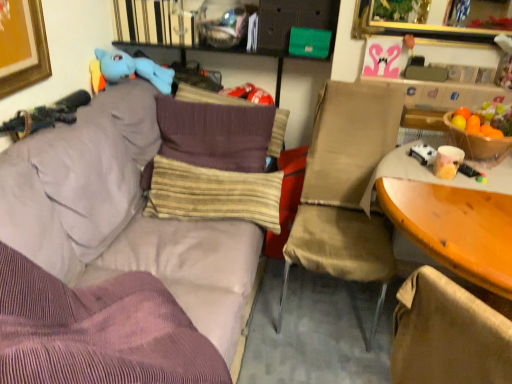
This screenshot has width=512, height=384. What do you see at coordinates (208, 97) in the screenshot? I see `purple corduroy pillow at center, marked as the 1th pillow in a top-to-bottom arrangement` at bounding box center [208, 97].

What do you see at coordinates (134, 69) in the screenshot? This screenshot has width=512, height=384. I see `blue plush toy at upper left` at bounding box center [134, 69].

This screenshot has height=384, width=512. Find the location of `wooden table at right`. wooden table at right is located at coordinates (449, 223).

At what (x,y) coordinates should I click in order to perform the action: click on purple corduroy couch at upper left. Please return your answer as a coordinate pair (x, y). Looking at the image, I should click on (119, 240).

The image size is (512, 384). Identify the location of purple corduroy pillow at center, marked as the 1th pillow in a top-to-bottom arrangement. (208, 97).

Is blue plush toy at upper left beside wooden table at right?

No.

From a real-world perspective, does blue plush toy at upper left stand above wooden table at right?

Yes, from a real-world perspective, blue plush toy at upper left is on top of wooden table at right.

Considering the sizes of objects blue plush toy at upper left and wooden table at right in the image provided, who is taller, blue plush toy at upper left or wooden table at right?

Standing taller between the two is wooden table at right.

Consider the image. In the image, is blue plush toy at upper left positioned in front of or behind wooden table at right?

blue plush toy at upper left is positioned farther from the viewer than wooden table at right.

From the picture: From a real-world perspective, is wooden table at right physically below purple corduroy couch at upper left?

Incorrect, from a real-world perspective, wooden table at right is higher than purple corduroy couch at upper left.

In the image, is wooden table at right on the left side or the right side of purple corduroy couch at upper left?

wooden table at right is positioned on purple corduroy couch at upper left's right side.

This screenshot has height=384, width=512. Find the location of `studio couch in front of the wooden table at right`. studio couch in front of the wooden table at right is located at coordinates (119, 240).

From the image's perspective, which is above, wooden table at right or purple corduroy couch at upper left?

From the image's view, purple corduroy couch at upper left is above.

How distant is beige fabric chair at center from purple corduroy pillow at center, positioned as the first pillow in back-to-front order?

beige fabric chair at center is 26.23 inches from purple corduroy pillow at center, positioned as the first pillow in back-to-front order.

Considering the relative sizes of beige fabric chair at center and purple corduroy pillow at center, which is the second pillow in front-to-back order, in the image provided, is beige fabric chair at center bigger than purple corduroy pillow at center, which is the second pillow in front-to-back order,?

Correct, beige fabric chair at center is larger in size than purple corduroy pillow at center, which is the second pillow in front-to-back order.

In order to click on chair below the purple corduroy pillow at center, which is counted as the 2th pillow, starting from the bottom (from the image's perspective) in this screenshot , I will do `click(345, 190)`.

Is blue plush toy at upper left in contact with beige fabric chair at center?

No, blue plush toy at upper left is not with beige fabric chair at center.

Which point is more forward, (129, 69) or (381, 290)?

The point (381, 290) is closer to the camera.

In the image, is blue plush toy at upper left on the left side or the right side of beige fabric chair at center?

Clearly, blue plush toy at upper left is on the left of beige fabric chair at center in the image.

Would you say beige fabric chair at center is part of blue plush toy at upper left's contents?

That's incorrect, beige fabric chair at center is not inside blue plush toy at upper left.

From the image's perspective, which one is positioned lower, striped fabric pillow at center, which is the 1th pillow in front-to-back order, or purple corduroy pillow at center, which is the second pillow in front-to-back order?

striped fabric pillow at center, which is the 1th pillow in front-to-back order, appears lower in the image.

From a real-world perspective, between striped fabric pillow at center, the first pillow from the bottom, and purple corduroy pillow at center, which is the second pillow in front-to-back order, who is vertically lower?

From a 3D spatial view, striped fabric pillow at center, the first pillow from the bottom, is below.

How different are the orientations of striped fabric pillow at center, acting as the 2th pillow starting from the back, and purple corduroy pillow at center, which is the second pillow in front-to-back order, in degrees?

striped fabric pillow at center, acting as the 2th pillow starting from the back, and purple corduroy pillow at center, which is the second pillow in front-to-back order, are facing 0.000933 degrees away from each other.

Considering their positions, is striped fabric pillow at center, acting as the 2th pillow starting from the back, located in front of or behind purple corduroy pillow at center, which is the second pillow in front-to-back order?

striped fabric pillow at center, acting as the 2th pillow starting from the back, is positioned closer to the viewer than purple corduroy pillow at center, which is the second pillow in front-to-back order.

Considering their positions, is purple corduroy pillow at center, positioned as the first pillow in back-to-front order, located in front of or behind striped fabric pillow at center, the first pillow from the bottom?

Clearly, purple corduroy pillow at center, positioned as the first pillow in back-to-front order, is behind striped fabric pillow at center, the first pillow from the bottom.

Are purple corduroy pillow at center, which is the second pillow in front-to-back order, and striped fabric pillow at center, positioned as the second pillow in top-to-bottom order, far apart?

purple corduroy pillow at center, which is the second pillow in front-to-back order, is actually quite close to striped fabric pillow at center, positioned as the second pillow in top-to-bottom order.

Considering the positions of objects purple corduroy pillow at center, which is the second pillow in front-to-back order, and striped fabric pillow at center, the first pillow from the bottom, in the image provided, who is more to the left, purple corduroy pillow at center, which is the second pillow in front-to-back order, or striped fabric pillow at center, the first pillow from the bottom,?

striped fabric pillow at center, the first pillow from the bottom, is more to the left.

Considering the sizes of striped fabric pillow at center, the first pillow from the bottom, and beige fabric chair at center in the image, is striped fabric pillow at center, the first pillow from the bottom, taller or shorter than beige fabric chair at center?

striped fabric pillow at center, the first pillow from the bottom, is shorter than beige fabric chair at center.

Do you think striped fabric pillow at center, the first pillow from the bottom, is within beige fabric chair at center, or outside of it?

striped fabric pillow at center, the first pillow from the bottom, is not enclosed by beige fabric chair at center.

Does striped fabric pillow at center, acting as the 2th pillow starting from the back, have a larger size compared to beige fabric chair at center?

Incorrect, striped fabric pillow at center, acting as the 2th pillow starting from the back, is not larger than beige fabric chair at center.

Is striped fabric pillow at center, which is the 1th pillow in front-to-back order, touching beige fabric chair at center?

striped fabric pillow at center, which is the 1th pillow in front-to-back order, and beige fabric chair at center are not in contact.

This screenshot has height=384, width=512. In order to click on toy on the left of wooden table at right in this screenshot , I will do `click(134, 69)`.

Identify the location of studio couch that is under the wooden table at right (from a real-world perspective). The width and height of the screenshot is (512, 384). (119, 240).

Looking at this image, estimate the real-world distances between objects in this image. Which object is closer to striped fabric pillow at center, which is the 1th pillow in front-to-back order, blue plush toy at upper left or beige fabric chair at center?

beige fabric chair at center is positioned closer to the anchor striped fabric pillow at center, which is the 1th pillow in front-to-back order.

Looking at the image, which one is located further to beige fabric chair at center, purple corduroy pillow at center, positioned as the first pillow in back-to-front order, or striped fabric pillow at center, which is the 1th pillow in front-to-back order?

Based on the image, purple corduroy pillow at center, positioned as the first pillow in back-to-front order, appears to be further to beige fabric chair at center.

Based on their spatial positions, is beige fabric chair at center or blue plush toy at upper left closer to purple corduroy pillow at center, marked as the 1th pillow in a top-to-bottom arrangement?

blue plush toy at upper left.

Considering their positions, is purple corduroy couch at upper left positioned further to blue plush toy at upper left than beige fabric chair at center?

beige fabric chair at center is further to blue plush toy at upper left.

Estimate the real-world distances between objects in this image. Which object is further from purple corduroy couch at upper left, blue plush toy at upper left or striped fabric pillow at center, which is the 1th pillow in front-to-back order?

Based on the image, blue plush toy at upper left appears to be further to purple corduroy couch at upper left.

Considering their positions, is purple corduroy pillow at center, which is the second pillow in front-to-back order, positioned closer to wooden table at right than blue plush toy at upper left?

Based on the image, purple corduroy pillow at center, which is the second pillow in front-to-back order, appears to be nearer to wooden table at right.

Looking at the image, which one is located further to blue plush toy at upper left, wooden table at right or striped fabric pillow at center, acting as the 2th pillow starting from the back?

wooden table at right is further to blue plush toy at upper left.

From the image, which object appears to be farther from purple corduroy pillow at center, which is counted as the 2th pillow, starting from the bottom, blue plush toy at upper left or wooden table at right?

Based on the image, wooden table at right appears to be further to purple corduroy pillow at center, which is counted as the 2th pillow, starting from the bottom.

You are a GUI agent. You are given a task and a screenshot of the screen. Output one action in this format:
    pyautogui.click(x=<x>, y=<y>)
    Task: Click on the pillow located between purple corduroy couch at upper left and blue plush toy at upper left in the depth direction
    
    Given the screenshot: What is the action you would take?
    pyautogui.click(x=213, y=194)

Locate an element on the screen. The width and height of the screenshot is (512, 384). pillow between blue plush toy at upper left and striped fabric pillow at center, which is the 1th pillow in front-to-back order, in the vertical direction is located at coordinates (208, 97).

Identify the location of chair between wooden table at right and purple corduroy pillow at center, which is the second pillow in front-to-back order, from front to back. The image size is (512, 384). (x=345, y=190).

Where is `pillow between wooden table at right and blue plush toy at upper left along the z-axis`? The image size is (512, 384). pillow between wooden table at right and blue plush toy at upper left along the z-axis is located at coordinates (213, 194).